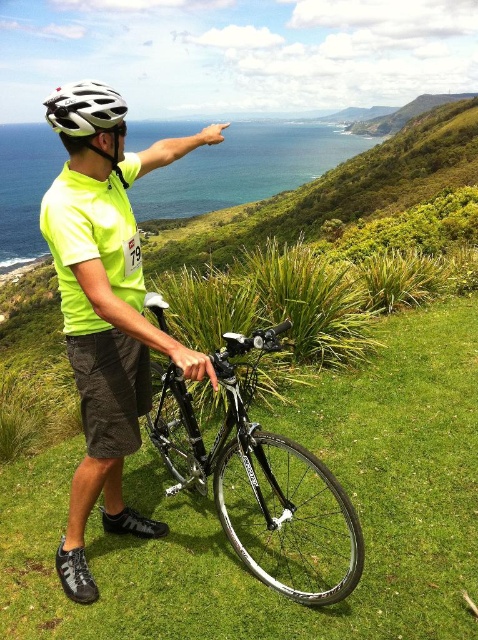
Question: Which point is farther to the camera?

Choices:
 (A) shiny black bicycle at center
 (B) green grassy at center

Answer: (B)

Question: Where is green grassy at center located in relation to shiny black bicycle at center in the image?

Choices:
 (A) left
 (B) right

Answer: (B)

Question: Is green grassy at center further to the viewer compared to shiny black bicycle at center?

Choices:
 (A) no
 (B) yes

Answer: (B)

Question: Which of these objects is positioned farthest from the white matte bicycle helmet at upper center?

Choices:
 (A) shiny black bicycle at center
 (B) neon yellow shirt at center

Answer: (A)

Question: Is shiny black bicycle at center smaller than white matte bicycle helmet at upper center?

Choices:
 (A) yes
 (B) no

Answer: (A)

Question: Which object appears farthest from the camera in this image?

Choices:
 (A) green grassy at center
 (B) shiny black bicycle at center
 (C) white matte bicycle helmet at upper center

Answer: (A)